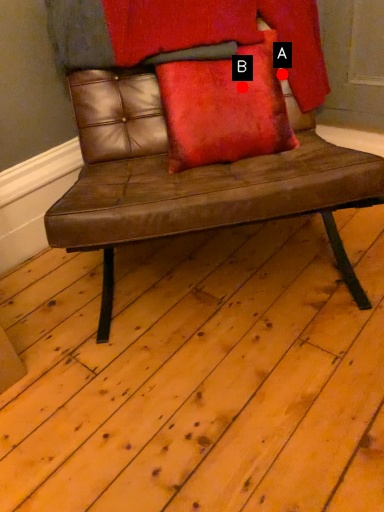
Question: Two points are circled on the image, labeled by A and B beside each circle. Which point appears closest to the camera in this image?

Choices:
 (A) A is closer
 (B) B is closer

Answer: (B)